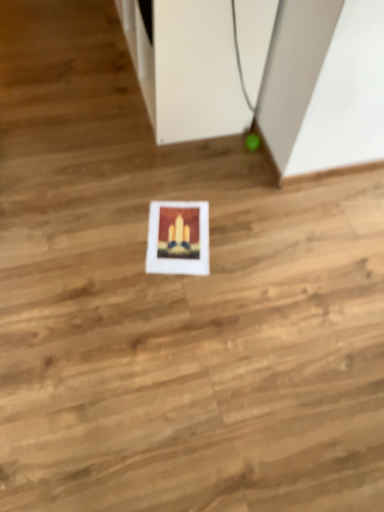
In order to click on white glossy cabinet at upper center in this screenshot , I will do point(187,68).

What do you see at coordinates (187, 68) in the screenshot?
I see `white glossy cabinet at upper center` at bounding box center [187, 68].

What are the coordinates of `white glossy cabinet at upper center` in the screenshot? It's located at (187, 68).